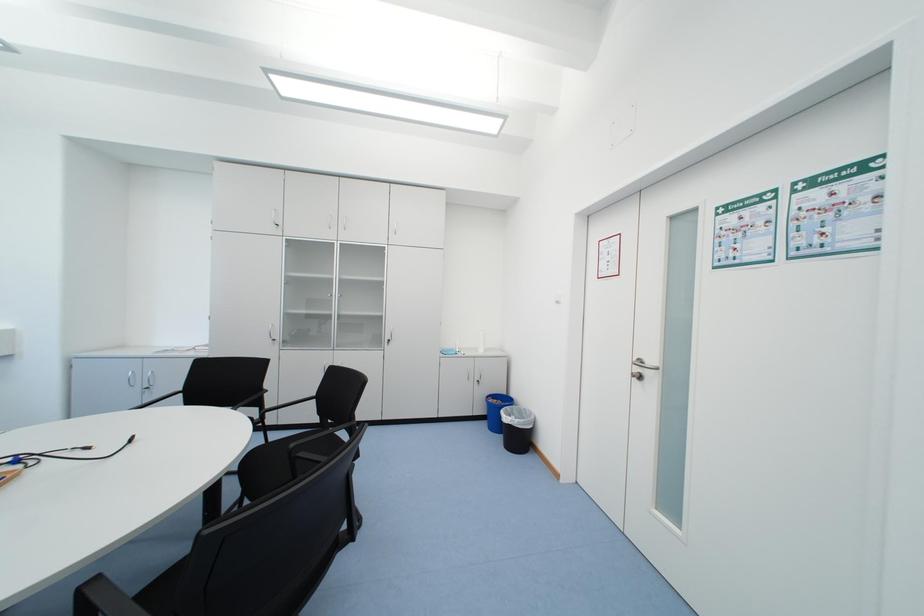
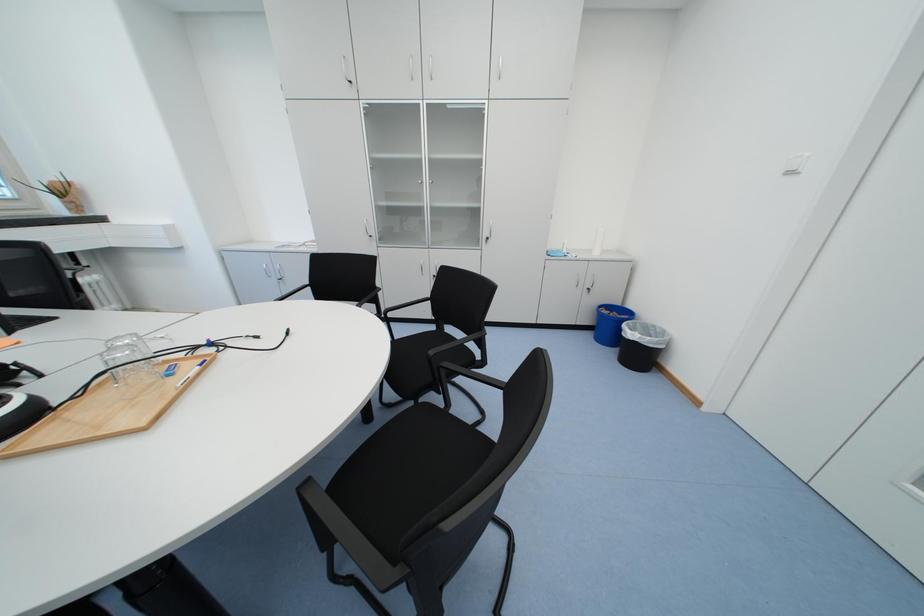
Consider the image. Which direction would the cameraman need to move to produce the second image?

The cameraman moved toward left, forward.